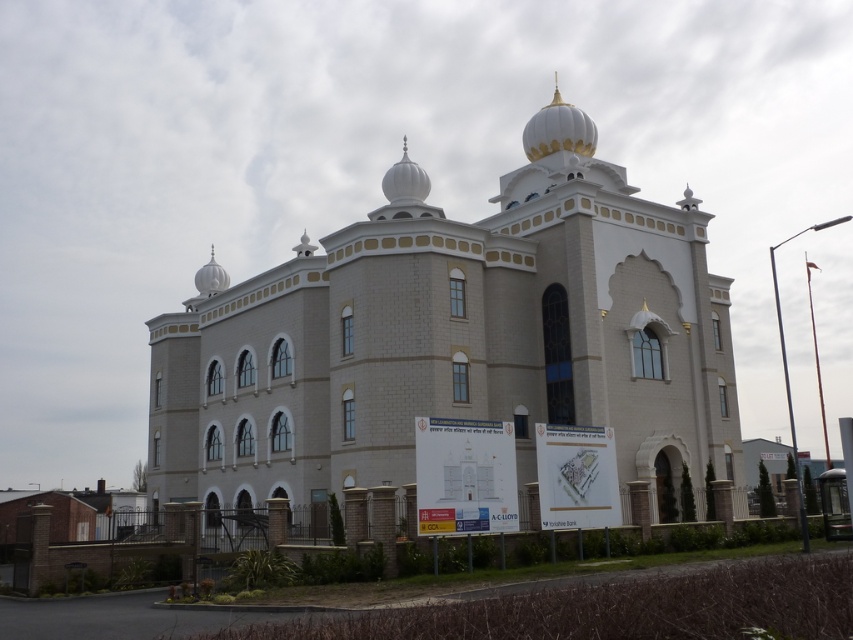
From the picture: You are standing at the camera position looking at the building. There is a point marked at coordinates (384, 440) on the building. If you want to place a 2.5 meter tall flagpole at that point, will it be visible from your current position?

The point at (384, 440) is 55.30 meters away from the camera. Since the flagpole is 2.5 meters tall, it would be visible from the current position as it is within the line of sight and distance.

In the scene shown: You are standing at the entrance of the building and want to take a photo of the white stone church at center. Where should you position yourself to capture it in the frame?

To capture the white stone church at center in the frame, position yourself at the entrance and aim your camera towards the center of the image, as the white stone church at center is located at the central point coordinates of approximately 0.536 on the x and 0.529 on the y axis.

You are an architect visiting the site and need to determine the spatial relationship between the white stone church at center and the white glossy dome at upper center. Based on the scene, which object occupies more horizontal space?

The white stone church at center has a larger width than the white glossy dome at upper center, so it occupies more horizontal space.